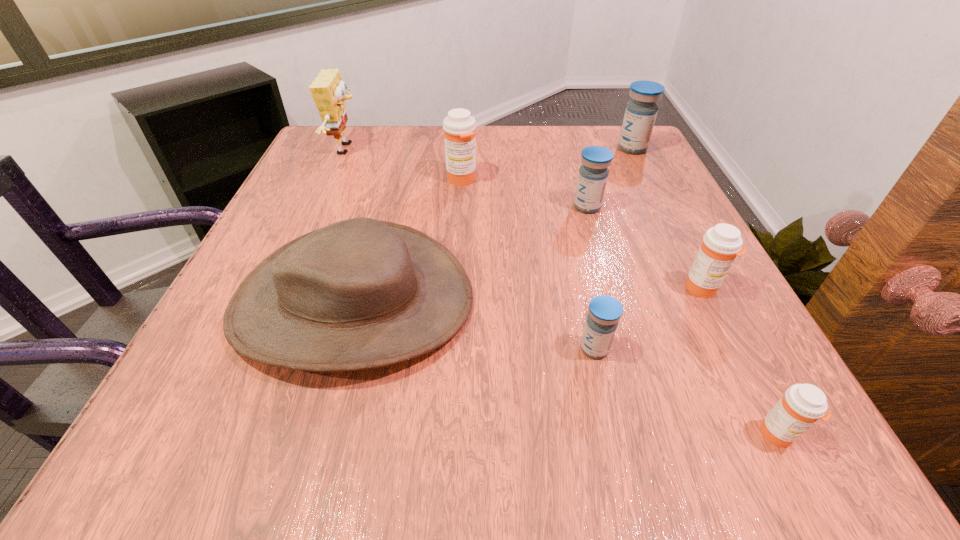
This screenshot has height=540, width=960. I want to click on object that is the sixth closest to the smallest blue medicine, so click(640, 114).

At what (x,y) coordinates should I click in order to perform the action: click on object that is the second nearest to the leftmost orange medicine. Please return your answer as a coordinate pair (x, y). The image size is (960, 540). Looking at the image, I should click on (593, 174).

Locate which medicine ranks fourth in proximity to the nearest object. Please provide its 2D coordinates. Your answer should be formatted as a tuple, i.e. [(x, y)], where the tuple contains the x and y coordinates of a point satisfying the conditions above.

[(459, 126)]

Select which medicine appears as the second closest to the sponge. Please provide its 2D coordinates. Your answer should be formatted as a tuple, i.e. [(x, y)], where the tuple contains the x and y coordinates of a point satisfying the conditions above.

[(593, 174)]

You are a GUI agent. You are given a task and a screenshot of the screen. Output one action in this format:
    pyautogui.click(x=<x>, y=<y>)
    Task: Click on the blue medicine that is the second closest to the farthest medicine
    This screenshot has width=960, height=540.
    Given the screenshot: What is the action you would take?
    605,311

Choose which blue medicine is the nearest neighbor to the nearest object. Please provide its 2D coordinates. Your answer should be formatted as a tuple, i.e. [(x, y)], where the tuple contains the x and y coordinates of a point satisfying the conditions above.

[(605, 311)]

The image size is (960, 540). I want to click on the second closest orange medicine relative to the nearest orange medicine, so click(459, 126).

Identify which orange medicine is the closest to the nearest blue medicine. Please provide its 2D coordinates. Your answer should be formatted as a tuple, i.e. [(x, y)], where the tuple contains the x and y coordinates of a point satisfying the conditions above.

[(721, 244)]

Where is `free region that satisfies the following two spatial constraints: 1. on the face of the yellow sponge; 2. on the left side of the brown cowboy hat`? free region that satisfies the following two spatial constraints: 1. on the face of the yellow sponge; 2. on the left side of the brown cowboy hat is located at coordinates (280, 301).

Locate an element on the screen. vacant space that satisfies the following two spatial constraints: 1. on the face of the leftmost medicine; 2. on the left side of the yellow sponge is located at coordinates (334, 179).